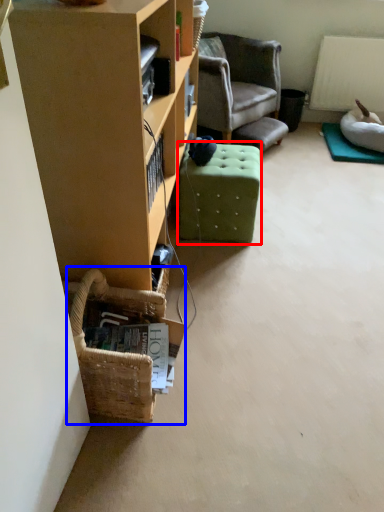
Question: Which object is closer to the camera taking this photo, stool (highlighted by a red box) or basket (highlighted by a blue box)?

Choices:
 (A) stool
 (B) basket

Answer: (B)